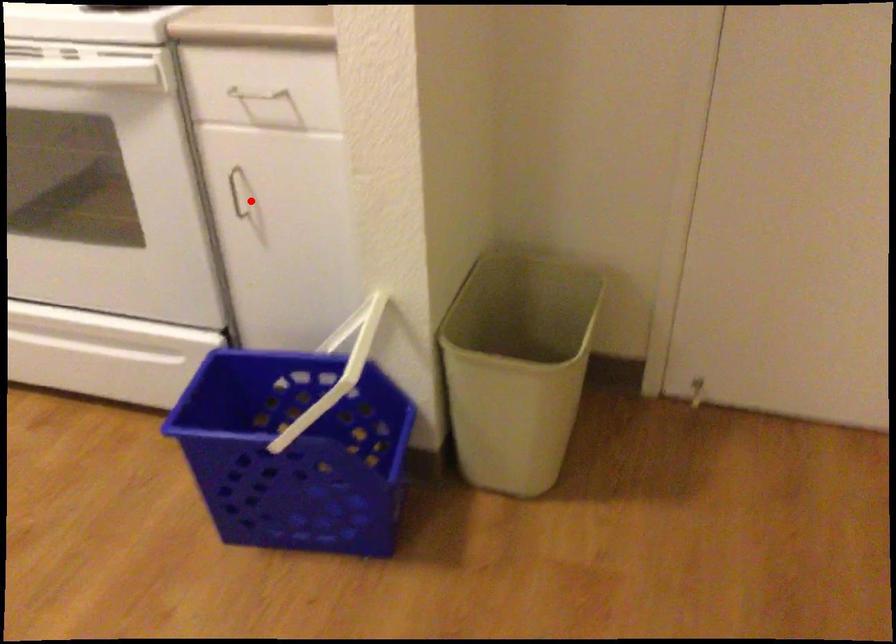
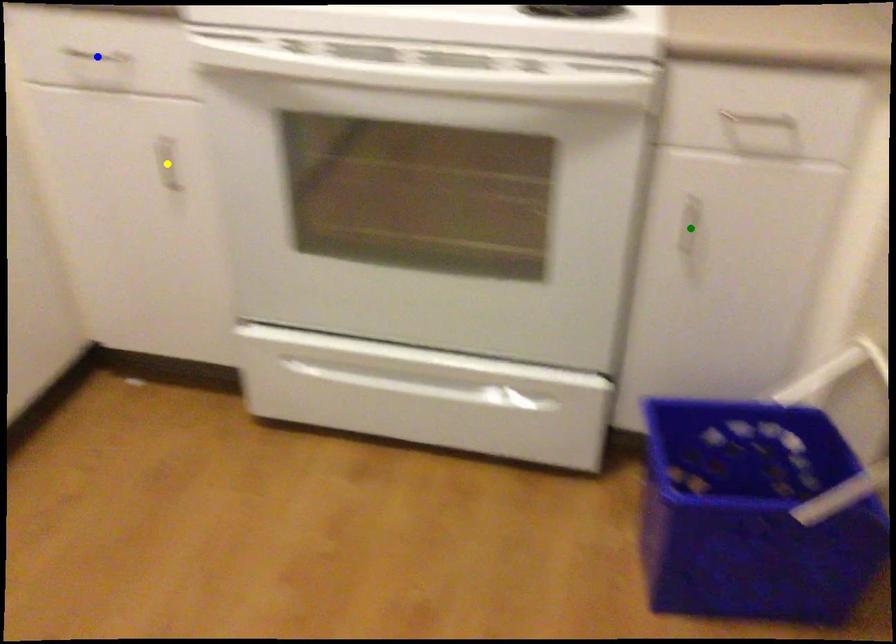
Question: I am providing you with two images of the same scene from different viewpoints. A red point is marked on the first image. You are given multiple points on the second image. Which point in image 2 represents the same 3d spot as the red point in image 1?

Choices:
 (A) yellow point
 (B) green point
 (C) blue point

Answer: (B)